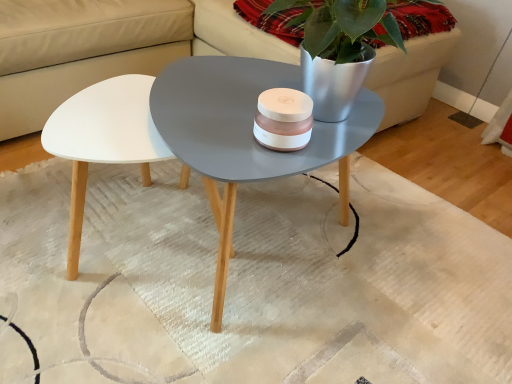
This screenshot has width=512, height=384. Describe the element at coordinates (106, 47) in the screenshot. I see `white leather couch at upper center` at that location.

What do you see at coordinates (261, 277) in the screenshot? I see `white textured rug at center` at bounding box center [261, 277].

This screenshot has width=512, height=384. What do you see at coordinates (342, 27) in the screenshot? I see `metallic silver pot at upper right` at bounding box center [342, 27].

Find the location of a particular element. The height and width of the screenshot is (384, 512). white leather couch at upper center is located at coordinates (106, 47).

From the image's perspective, which object appears higher, white textured rug at center or white leather couch at upper center?

From the image's view, white leather couch at upper center is above.

Can you confirm if white textured rug at center is wider than white leather couch at upper center?

No.

Considering the sizes of objects white textured rug at center and white leather couch at upper center in the image provided, who is smaller, white textured rug at center or white leather couch at upper center?

Smaller between the two is white textured rug at center.

Considering the relative sizes of metallic silver pot at upper right and white leather couch at upper center in the image provided, is metallic silver pot at upper right taller than white leather couch at upper center?

In fact, metallic silver pot at upper right may be shorter than white leather couch at upper center.

Is metallic silver pot at upper right next to white leather couch at upper center and touching it?

No, metallic silver pot at upper right is not touching white leather couch at upper center.

Considering the sizes of metallic silver pot at upper right and white leather couch at upper center in the image, is metallic silver pot at upper right bigger or smaller than white leather couch at upper center?

metallic silver pot at upper right is smaller than white leather couch at upper center.

In the scene shown: Is metallic silver pot at upper right oriented away from white leather couch at upper center?

Yes, metallic silver pot at upper right's orientation is away from white leather couch at upper center.

Find the location of a particular element. This screenshot has height=384, width=512. mat below the metallic silver pot at upper right (from a real-world perspective) is located at coordinates pos(261,277).

How different are the orientations of metallic silver pot at upper right and white textured rug at center in degrees?

The angular difference between metallic silver pot at upper right and white textured rug at center is 88.6 degrees.

Looking at this image, from a real-world perspective, who is located lower, metallic silver pot at upper right or white textured rug at center?

In real-world perspective, white textured rug at center is lower.

Can you confirm if metallic silver pot at upper right is bigger than white textured rug at center?

Result: No.

From a real-world perspective, between white leather couch at upper center and white textured rug at center, who is vertically lower?

From a 3D spatial view, white textured rug at center is below.

Which of these two, white leather couch at upper center or white textured rug at center, is bigger?

white leather couch at upper center is bigger.

What's the angular difference between white leather couch at upper center and white textured rug at center's facing directions?

88.6 degrees.

In the scene shown: In terms of height, does white leather couch at upper center look taller or shorter compared to white textured rug at center?

Clearly, white leather couch at upper center is taller compared to white textured rug at center.

Does point (164, 322) lie behind point (344, 56)?

Yes, it is.

From a real-world perspective, who is located higher, white textured rug at center or metallic silver pot at upper right?

metallic silver pot at upper right.

Is metallic silver pot at upper right completely or partially inside white textured rug at center?

No, metallic silver pot at upper right is located outside of white textured rug at center.

The image size is (512, 384). I want to click on plant behind the white textured rug at center, so 342,27.

Do you think white leather couch at upper center is within metallic silver pot at upper right, or outside of it?

white leather couch at upper center is outside metallic silver pot at upper right.

From a real-world perspective, which is physically above, white leather couch at upper center or metallic silver pot at upper right?

metallic silver pot at upper right is physically above.

From the image's perspective, would you say white leather couch at upper center is positioned over metallic silver pot at upper right?

Yes, from the image's perspective, white leather couch at upper center is over metallic silver pot at upper right.

Looking at the image, does white leather couch at upper center seem bigger or smaller compared to metallic silver pot at upper right?

In the image, white leather couch at upper center appears to be larger than metallic silver pot at upper right.

You are a GUI agent. You are given a task and a screenshot of the screen. Output one action in this format:
    pyautogui.click(x=<x>, y=<y>)
    Task: Click on the mat to the left of white leather couch at upper center
    
    Given the screenshot: What is the action you would take?
    pyautogui.click(x=261, y=277)

Locate an element on the screen. This screenshot has width=512, height=384. plant behind the white leather couch at upper center is located at coordinates (342, 27).

When comparing their distances from white textured rug at center, does white leather couch at upper center or metallic silver pot at upper right seem further?

metallic silver pot at upper right is further to white textured rug at center.

Looking at the image, which one is located further to metallic silver pot at upper right, white textured rug at center or white leather couch at upper center?

Based on the image, white leather couch at upper center appears to be further to metallic silver pot at upper right.

Considering their positions, is metallic silver pot at upper right positioned closer to white leather couch at upper center than white textured rug at center?

white textured rug at center lies closer to white leather couch at upper center than the other object.

Based on their spatial positions, is metallic silver pot at upper right or white leather couch at upper center further from white textured rug at center?

metallic silver pot at upper right lies further to white textured rug at center than the other object.

Considering their positions, is white leather couch at upper center positioned closer to metallic silver pot at upper right than white textured rug at center?

Among the two, white textured rug at center is located nearer to metallic silver pot at upper right.

Looking at the image, which one is located further to white leather couch at upper center, white textured rug at center or metallic silver pot at upper right?

metallic silver pot at upper right is positioned further to the anchor white leather couch at upper center.

Where is `plant between white leather couch at upper center and white textured rug at center in the up-down direction`? The image size is (512, 384). plant between white leather couch at upper center and white textured rug at center in the up-down direction is located at coordinates (342, 27).